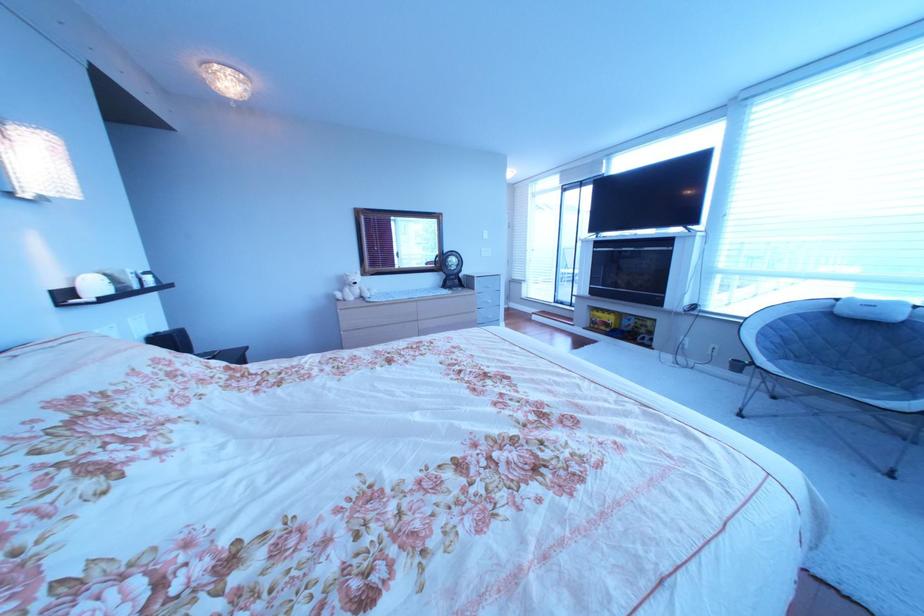
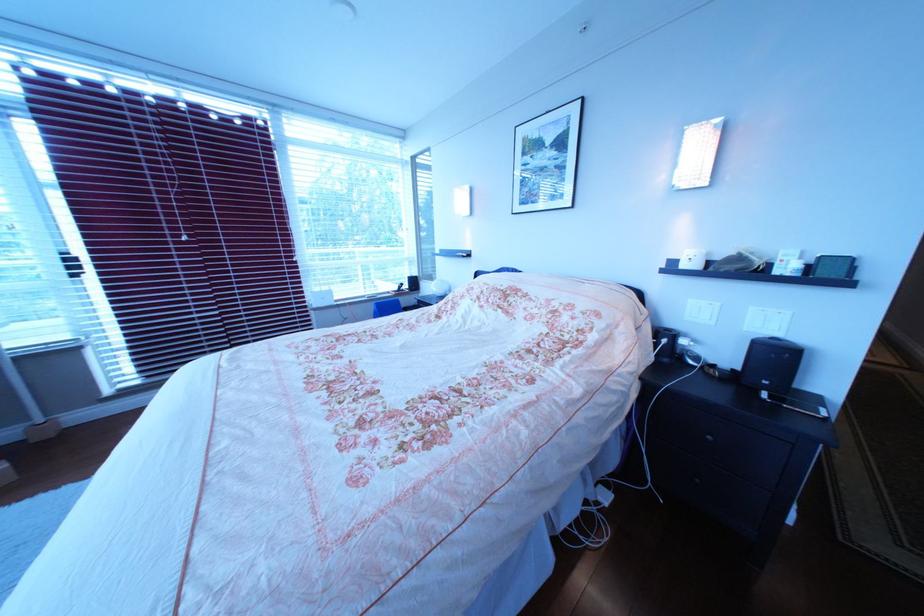
Find the pixel in the second image that matches point (146, 322) in the first image.

(767, 310)